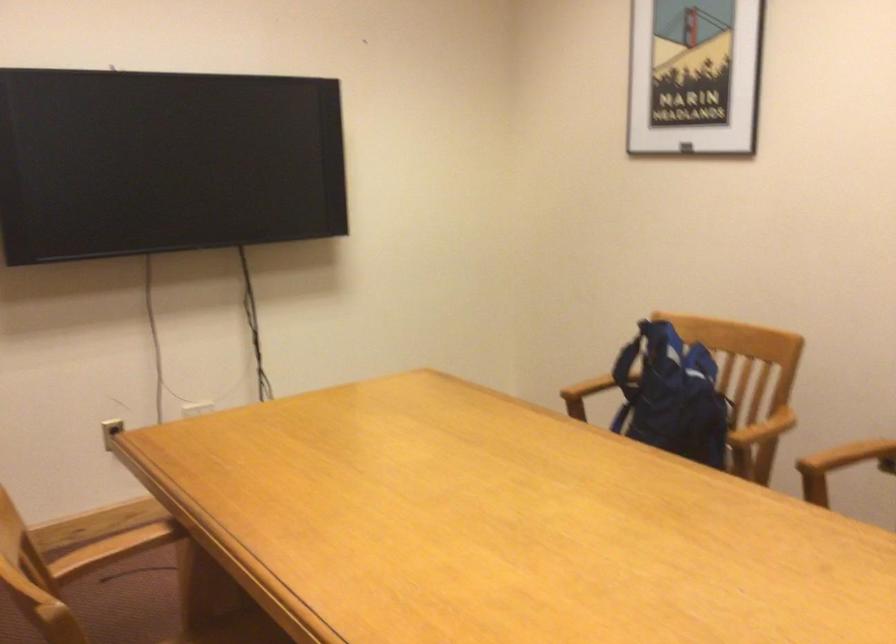
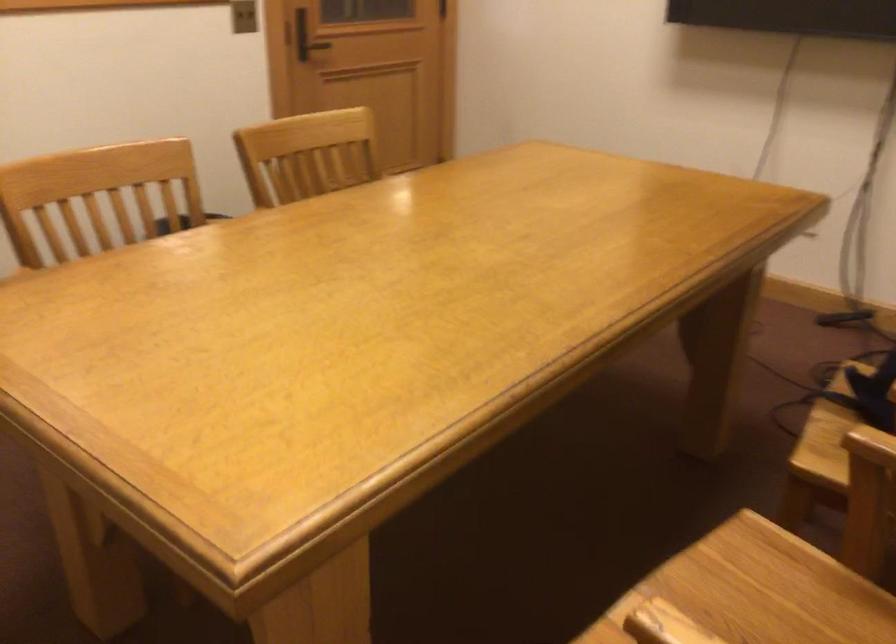
Question: I am providing you with two images of the same scene from different viewpoints. Which of the following objects are not visible in image2?

Choices:
 (A) wooden chair armrest
 (B) red plastic tray
 (C) chair sitting surface
 (D) black door handle

Answer: (A)